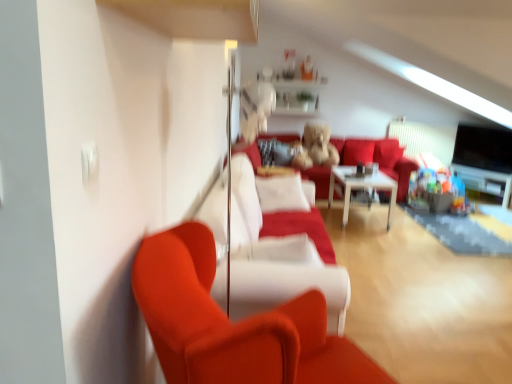
Question: Does matte red couch at left contain velvet red couch at center, the second couch viewed from the back?

Choices:
 (A) no
 (B) yes

Answer: (A)

Question: Is matte red couch at left in front of velvet red couch at center, the first couch viewed from the front?

Choices:
 (A) no
 (B) yes

Answer: (B)

Question: Considering the relative sizes of matte red couch at left and velvet red couch at center, the first couch viewed from the front, in the image provided, is matte red couch at left smaller than velvet red couch at center, the first couch viewed from the front,?

Choices:
 (A) no
 (B) yes

Answer: (B)

Question: From a real-world perspective, does matte red couch at left sit lower than velvet red couch at center, the first couch viewed from the front?

Choices:
 (A) yes
 (B) no

Answer: (B)

Question: Is matte red couch at left not within velvet red couch at center, the first couch viewed from the front?

Choices:
 (A) no
 (B) yes

Answer: (B)

Question: Looking at their shapes, would you say matte red couch at left is wider or thinner than white glossy table at center?

Choices:
 (A) wide
 (B) thin

Answer: (B)

Question: Looking at the image, does matte red couch at left seem bigger or smaller compared to white glossy table at center?

Choices:
 (A) small
 (B) big

Answer: (B)

Question: Is point (291, 304) positioned closer to the camera than point (368, 180)?

Choices:
 (A) closer
 (B) farther

Answer: (A)

Question: Would you say matte red couch at left is inside or outside white glossy table at center?

Choices:
 (A) inside
 (B) outside

Answer: (B)

Question: Visually, is velvet red couch at center, which is counted as the second couch, starting from the front, positioned to the left or to the right of white glossy table at center?

Choices:
 (A) right
 (B) left

Answer: (B)

Question: Is velvet red couch at center, placed as the first couch when sorted from back to front, bigger or smaller than white glossy table at center?

Choices:
 (A) small
 (B) big

Answer: (B)

Question: Is velvet red couch at center, placed as the first couch when sorted from back to front, taller or shorter than white glossy table at center?

Choices:
 (A) short
 (B) tall

Answer: (B)

Question: Which is correct: velvet red couch at center, placed as the first couch when sorted from back to front, is inside white glossy table at center, or outside of it?

Choices:
 (A) inside
 (B) outside

Answer: (B)

Question: From a real-world perspective, is matte red couch at left above or below white glossy shelf at upper center?

Choices:
 (A) above
 (B) below

Answer: (B)

Question: Considering the positions of matte red couch at left and white glossy shelf at upper center in the image, is matte red couch at left taller or shorter than white glossy shelf at upper center?

Choices:
 (A) tall
 (B) short

Answer: (A)